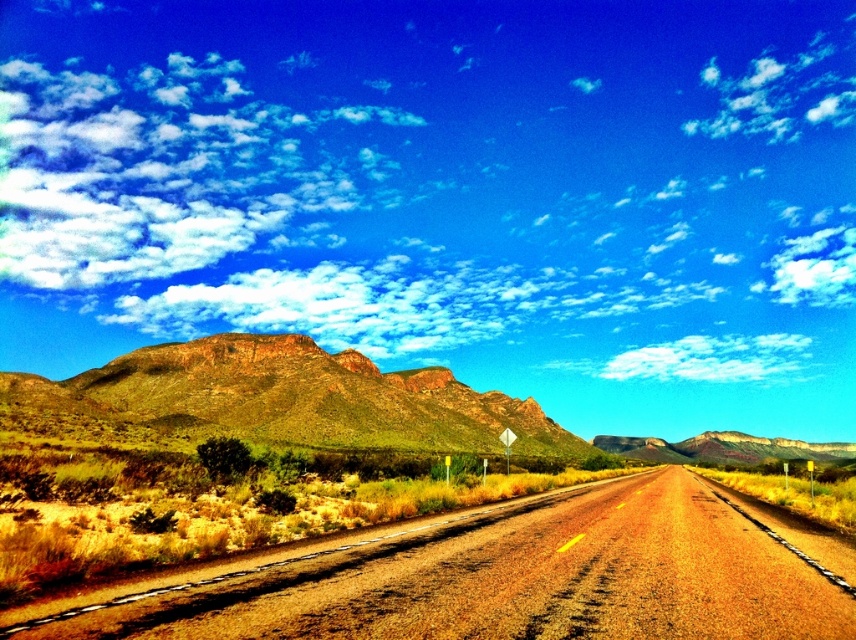
You are a hiker planning to cross the road from the green grassy mountain at left to the dried grass at center. Which direction should you head towards?

You should head towards the right direction since the dried grass at center is to the right of green grassy mountain at left according to the description.

You are a hiker planning to walk from the dried grass at center towards the green grassy mountain at left. Which direction should you head to get closer to the mountain?

To reach the green grassy mountain at left, you should head towards the left side of the road since the dried grass at center is closer to the viewer than the mountain, indicating the mountain is further away in that direction.

You are a hiker planning to cross the road in the image. You notice the dried grass at center and the green grassy mountain at left. Which of these two areas would be easier to walk through based on their height?

The dried grass at center is not as tall as the green grassy mountain at left, so it would be easier to walk through the dried grass at center since shorter vegetation offers less resistance and better visibility.